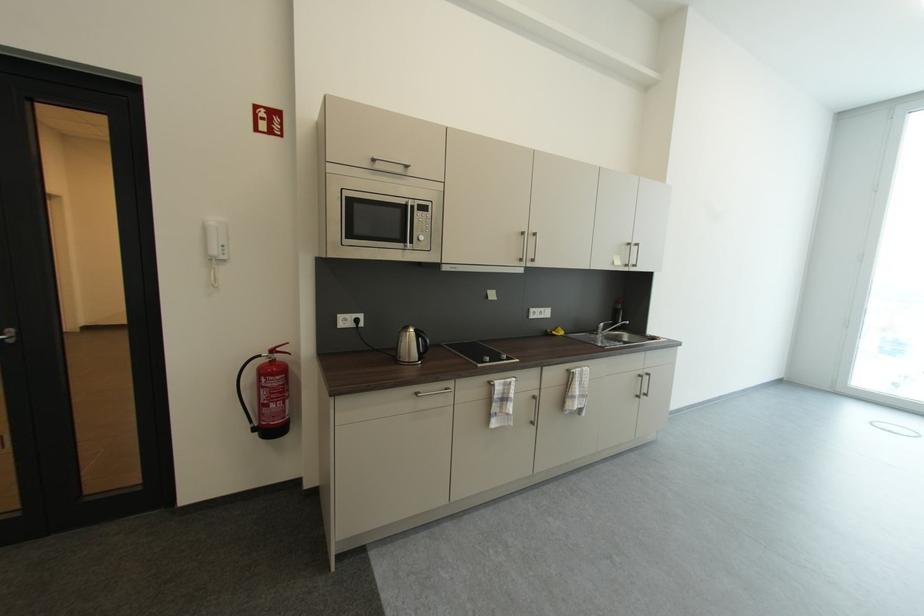
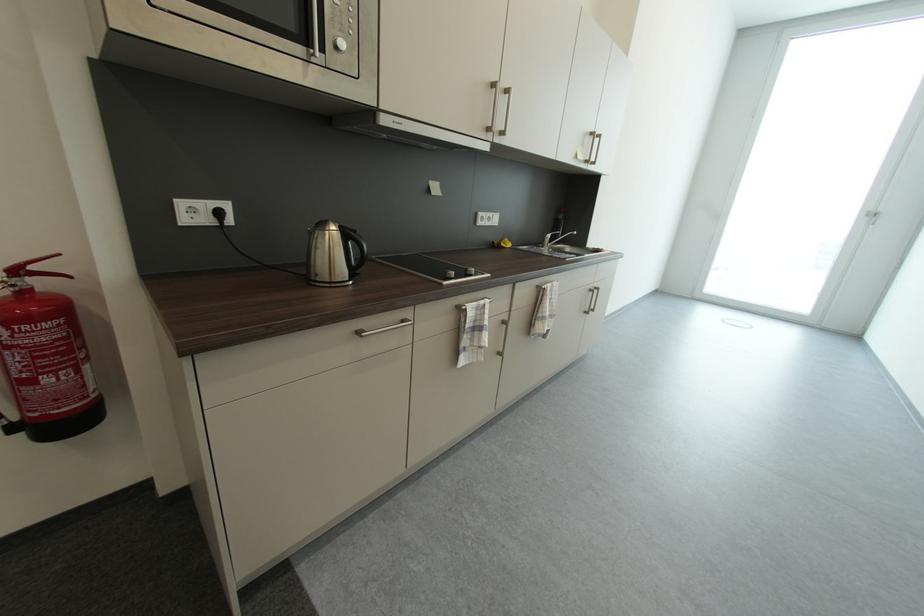
In the second image, find the point that corresponds to point 647,378 in the first image.

(598, 292)